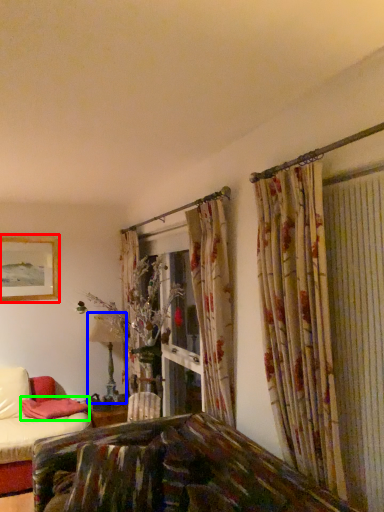
Question: Estimate the real-world distances between objects in this image. Which object is closer to picture frame (highlighted by a red box), table lamp (highlighted by a blue box) or pillow (highlighted by a green box)?

Choices:
 (A) table lamp
 (B) pillow

Answer: (A)